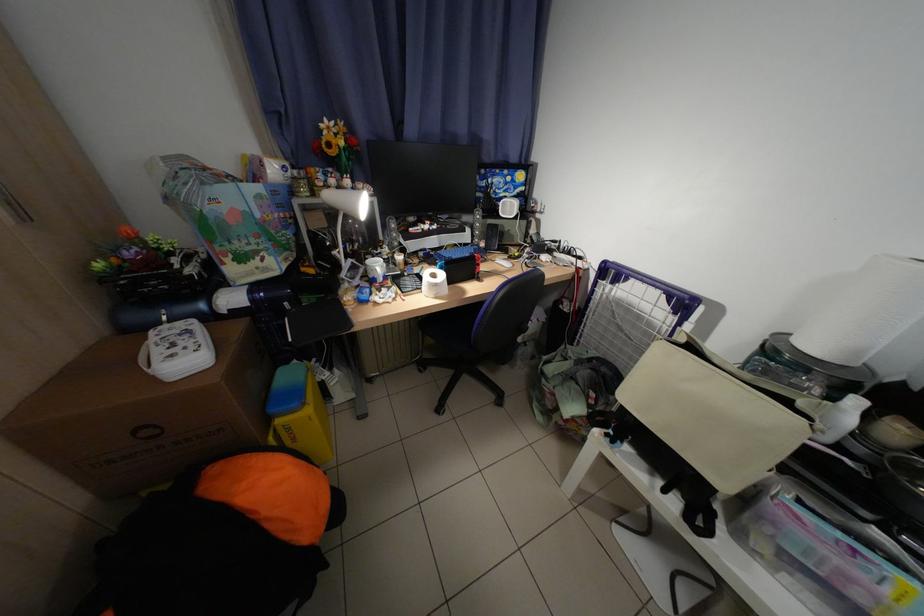
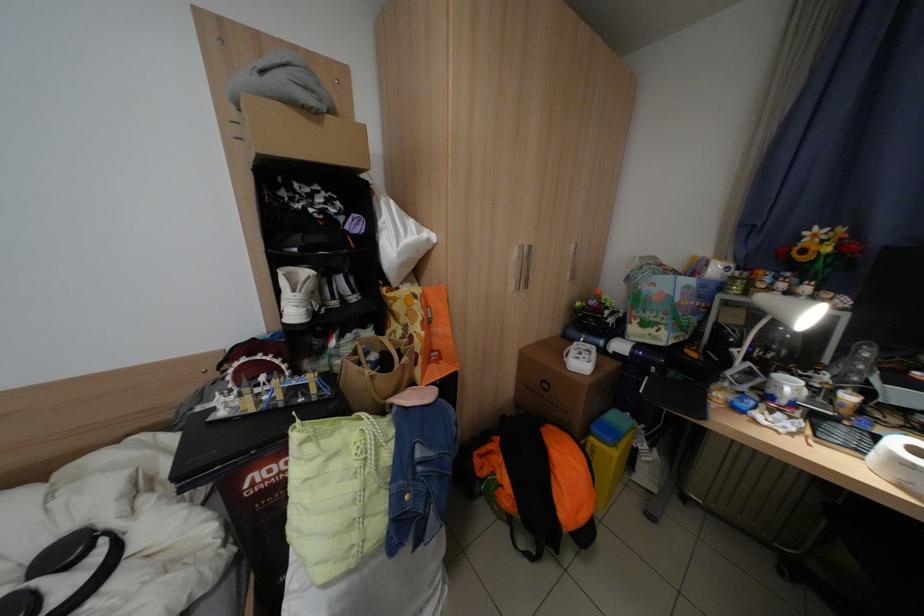
Locate, in the second image, the point that corresponds to (x=388, y=267) in the first image.

(800, 387)